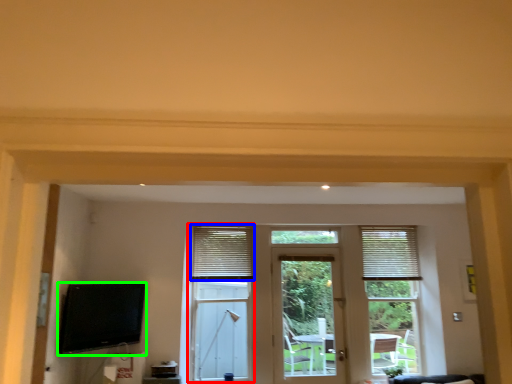
Question: Considering the real-world distances, which object is farthest from bay window (highlighted by a red box)? window blind (highlighted by a blue box) or television (highlighted by a green box)?

Choices:
 (A) window blind
 (B) television

Answer: (B)